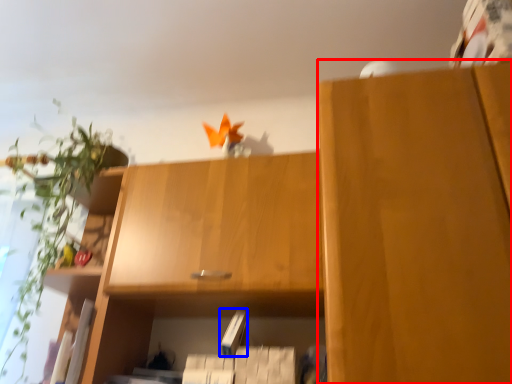
Question: Which of the following is the closest to the observer, cabinetry (highlighted by a red box) or paperback book (highlighted by a blue box)?

Choices:
 (A) cabinetry
 (B) paperback book

Answer: (A)